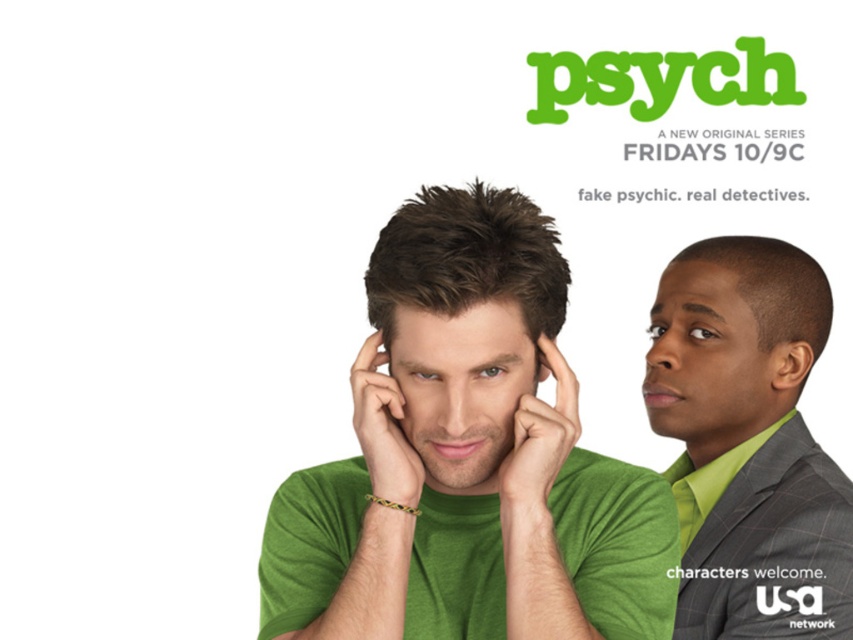
You are a costume designer analyzing the promotional poster for the TV series Psych. You need to determine the spatial relationship between the green textured suit at right and the matte green jaw at center. Which object is placed lower in the image?

The green textured suit at right is positioned under matte green jaw at center, so the green textured suit at right is placed lower in the image.

You are standing in front of the Psych TV series poster. You notice two points marked on the poster. The first point is at coordinates point [363,426] and the second point is at point [419,442]. From your perspective, which point is closer to you?

Point [419,442] is closer to you because point [363,426] is behind it.

You are designing a promotional poster for the TV series Psych. You need to ensure that the green matte bracelet at center and the matte green jaw at center are clearly visible. Since the background is white, which object might need to be adjusted in size to stand out more, and why?

The matte green jaw at center might need to be adjusted in size because it is smaller than the green matte bracelet at center, making it harder to notice against the white background.